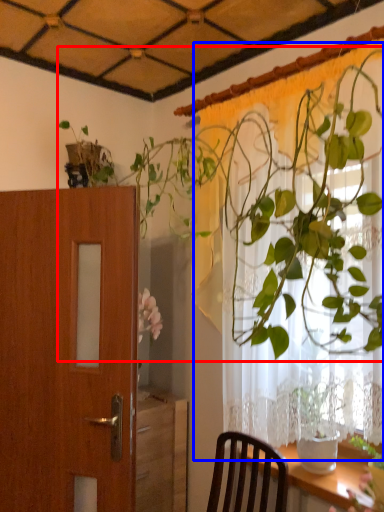
Question: Which of the following is the closest to the observer, houseplant (highlighted by a red box) or curtain (highlighted by a blue box)?

Choices:
 (A) houseplant
 (B) curtain

Answer: (A)